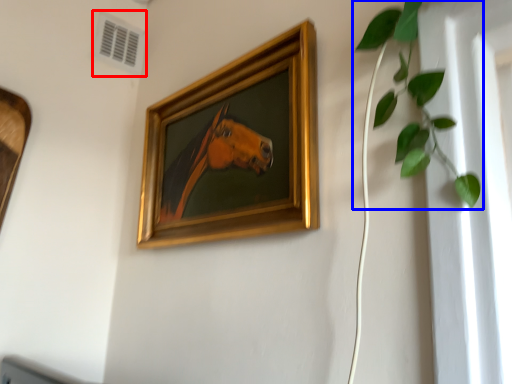
Question: Which point is closer to the camera, air conditioning (highlighted by a red box) or houseplant (highlighted by a blue box)?

Choices:
 (A) air conditioning
 (B) houseplant

Answer: (B)